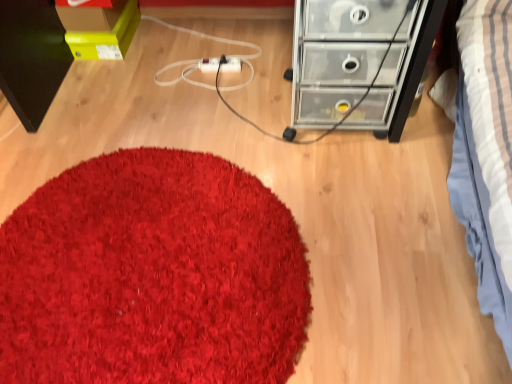
Image resolution: width=512 pixels, height=384 pixels. I want to click on vacant area that lies between white plastic extension cord at center and shaggy red carpet at center, so click(181, 114).